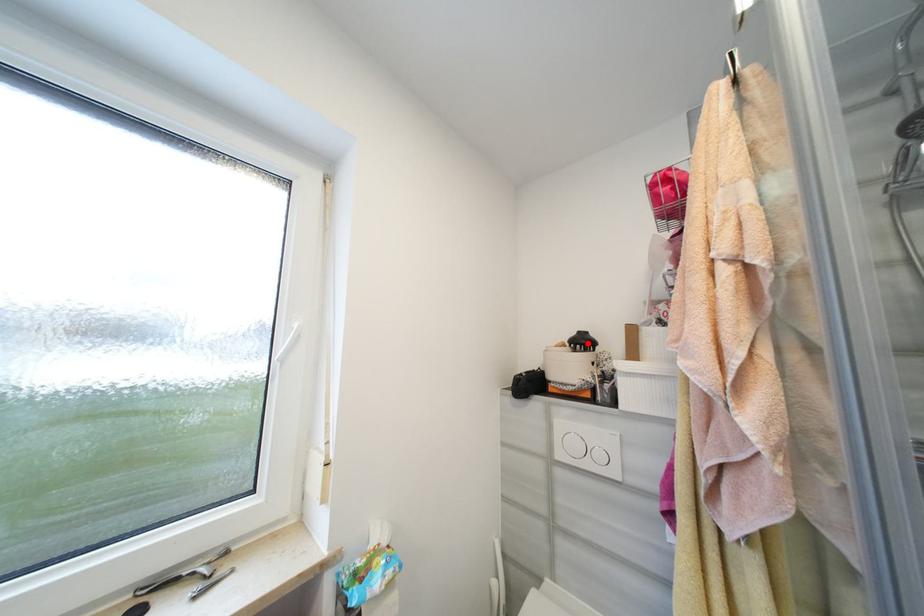
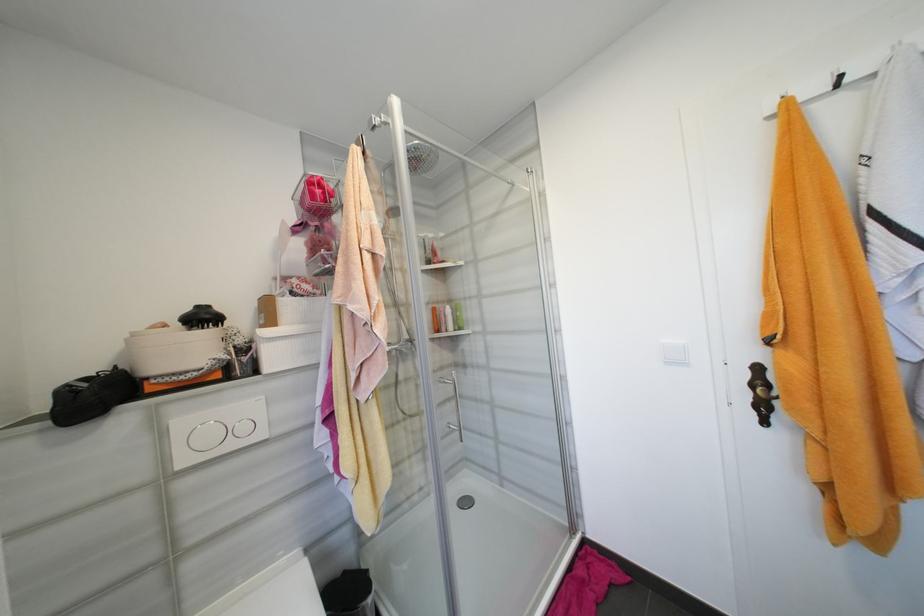
Where in the second image is the point corresponding to the highlighted location from the first image?

(210, 318)